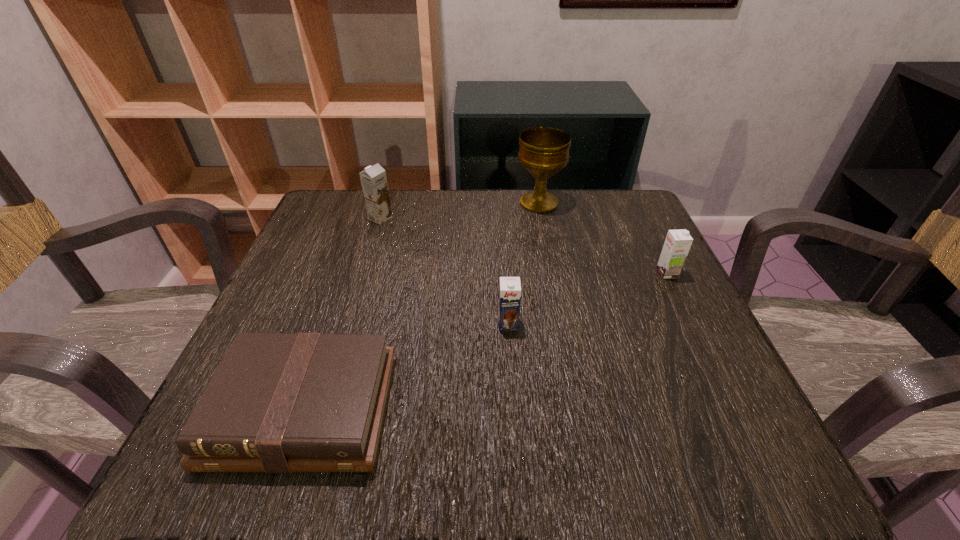
You are a GUI agent. You are given a task and a screenshot of the screen. Output one action in this format:
    pyautogui.click(x=<x>, y=<y>)
    Task: Click on the tallest object
    
    Given the screenshot: What is the action you would take?
    pyautogui.click(x=544, y=151)

You are a GUI agent. You are given a task and a screenshot of the screen. Output one action in this format:
    pyautogui.click(x=<x>, y=<y>)
    Task: Click on the fourth object from left to right
    The image size is (960, 540).
    Given the screenshot: What is the action you would take?
    click(x=544, y=151)

The image size is (960, 540). In order to click on the fourth shortest object in this screenshot , I will do `click(373, 179)`.

Where is `the leftmost chocolate milk`? The width and height of the screenshot is (960, 540). the leftmost chocolate milk is located at coordinates (373, 179).

At what (x,y) coordinates should I click in order to perform the action: click on the third farthest object. Please return your answer as a coordinate pair (x, y). The width and height of the screenshot is (960, 540). Looking at the image, I should click on (678, 242).

Where is `the second nearest chocolate milk`? The image size is (960, 540). the second nearest chocolate milk is located at coordinates (678, 242).

Find the location of `the second chocolate milk from right to left`. the second chocolate milk from right to left is located at coordinates (510, 288).

Locate an element on the screen. the fourth farthest object is located at coordinates (510, 288).

Find the location of `the nearest object`. the nearest object is located at coordinates (278, 402).

The image size is (960, 540). What are the coordinates of `the shortest object` in the screenshot? It's located at (278, 402).